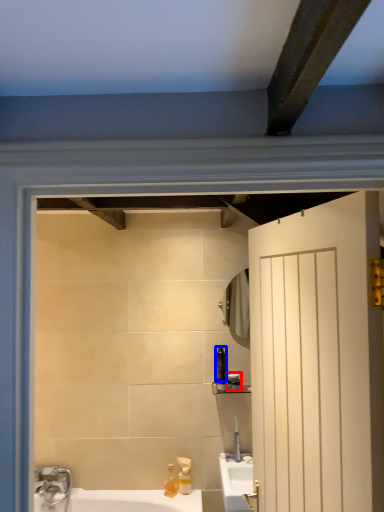
Question: Which of the following is the closest to the observer, toiletry (highlighted by a red box) or toiletry (highlighted by a blue box)?

Choices:
 (A) toiletry
 (B) toiletry

Answer: (B)